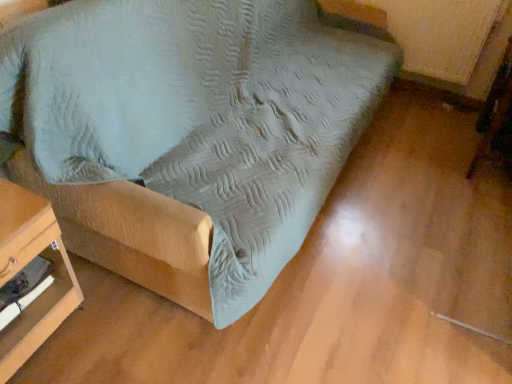
Identify the location of vacant area that lies in front of wooden swivel chair at lower right. (476, 205).